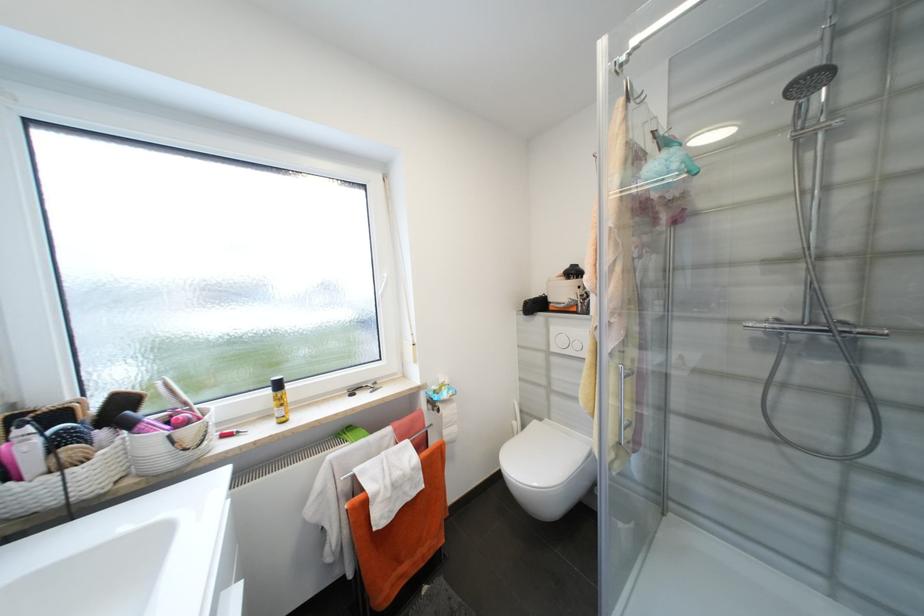
Locate an element on the screen. This screenshot has width=924, height=616. blue bath sponge is located at coordinates (666, 168).